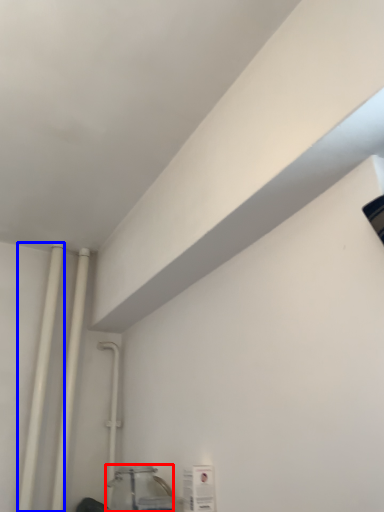
Question: Which of the following is the closest to the observer, glass jar (highlighted by a red box) or pipe (highlighted by a blue box)?

Choices:
 (A) glass jar
 (B) pipe

Answer: (A)